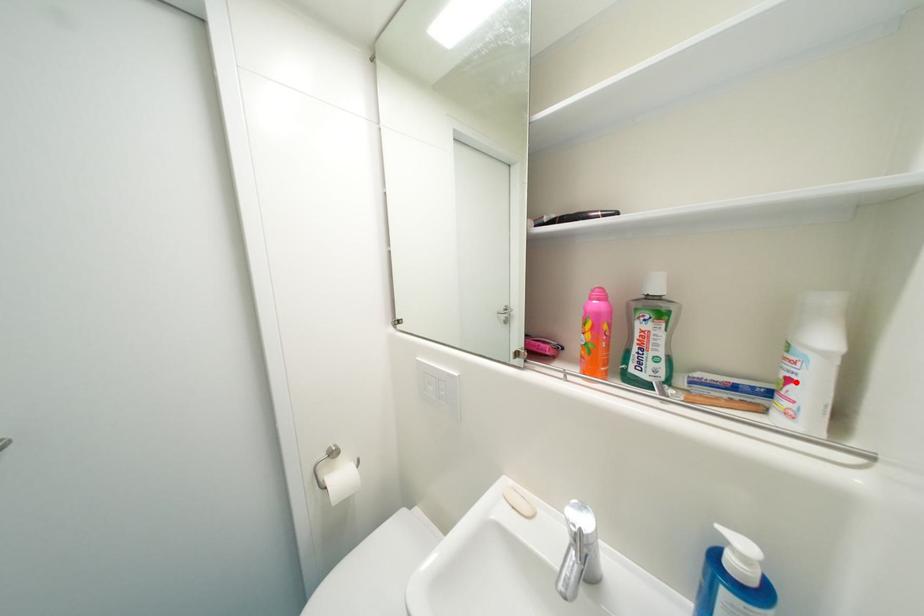
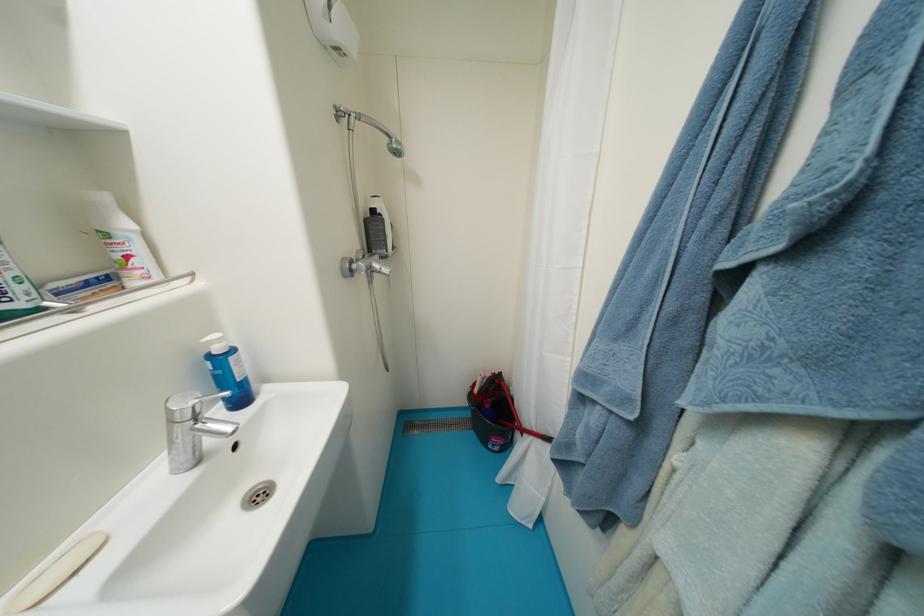
Find the pixel in the second image that matches the highlighted location in the first image.

(134, 259)